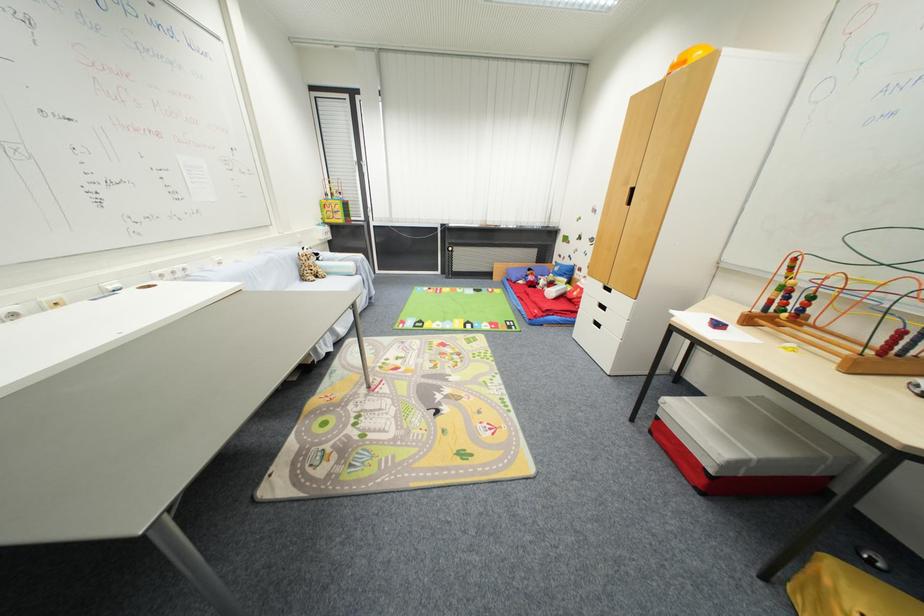
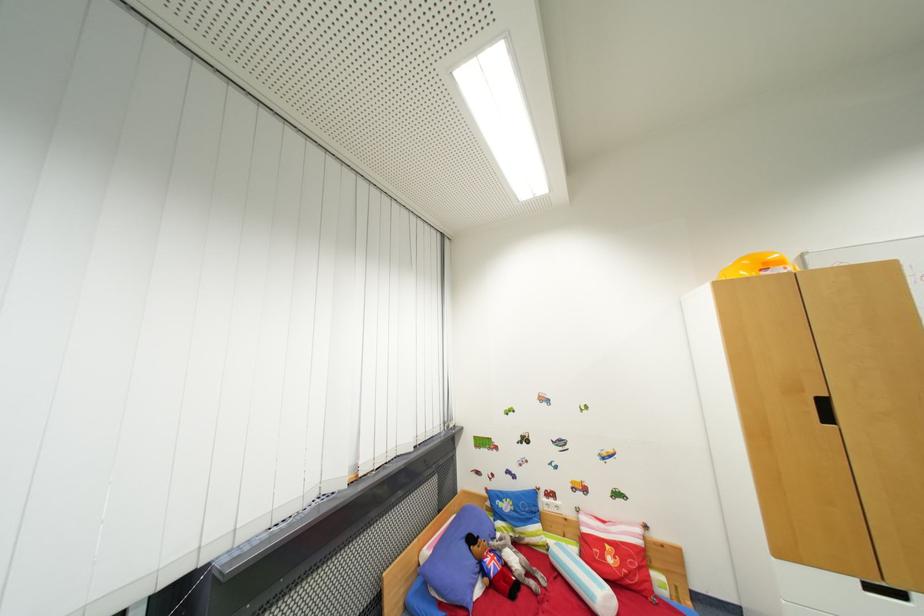
Where in the second image is the point corresponding to pixel 580 294 from the first image?

(614, 562)